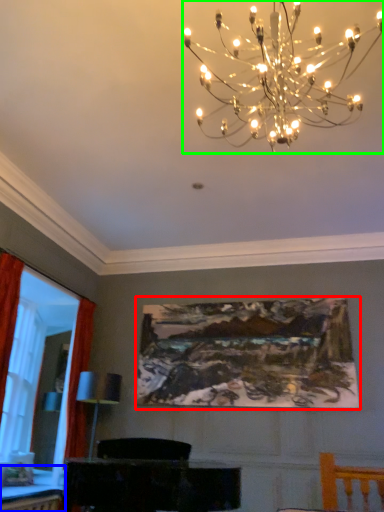
Question: Considering the real-world distances, which object is farthest from picture frame (highlighted by a red box)? table (highlighted by a blue box) or lamp (highlighted by a green box)?

Choices:
 (A) table
 (B) lamp

Answer: (B)